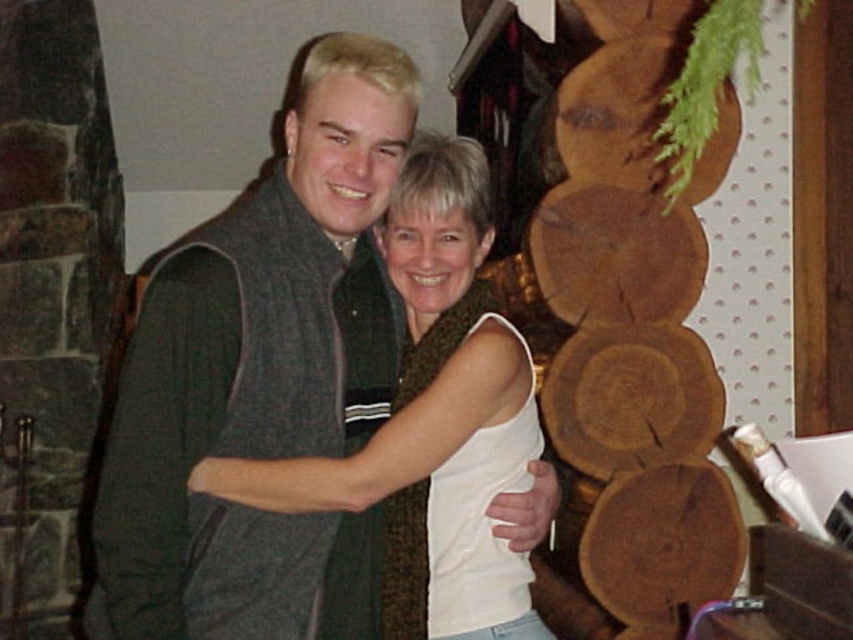
You are standing in front of the log cabin and want to reach a specific point marked at coordinates (167,308). If you take a step forward, will you be closer to or farther from that point?

The point at coordinates (167,308) is 4.82 feet away from the viewer. Taking a step forward would decrease the distance, so you would be closer to the point.

What is the object located at the coordinates point (262, 378) in the image?

The point (262, 378) marks the dark gray sweater vest at center.

You are a photographer trying to capture a closeup of the dark gray sweater vest at center and the white textured tank top at center. Which one is more to the left in the image?

The dark gray sweater vest at center is positioned on the left side of white textured tank top at center, so it is more to the left.